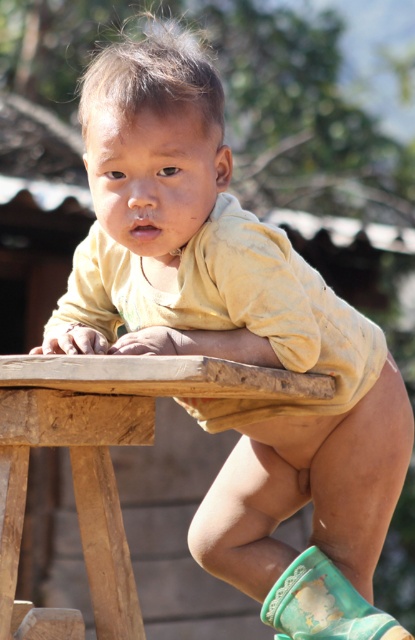
Question: Can you confirm if wooden table at center is wider than green rubber boot at lower right?

Choices:
 (A) yes
 (B) no

Answer: (A)

Question: Is wooden table at center smaller than green rubber boot at lower right?

Choices:
 (A) no
 (B) yes

Answer: (A)

Question: Is wooden table at center further to the viewer compared to green rubber boot at lower right?

Choices:
 (A) no
 (B) yes

Answer: (A)

Question: Which of the following is the closest to the observer?

Choices:
 (A) wooden table at center
 (B) green rubber boot at lower right

Answer: (A)

Question: Among these points, which one is nearest to the camera?

Choices:
 (A) (283, 580)
 (B) (70, 420)

Answer: (B)